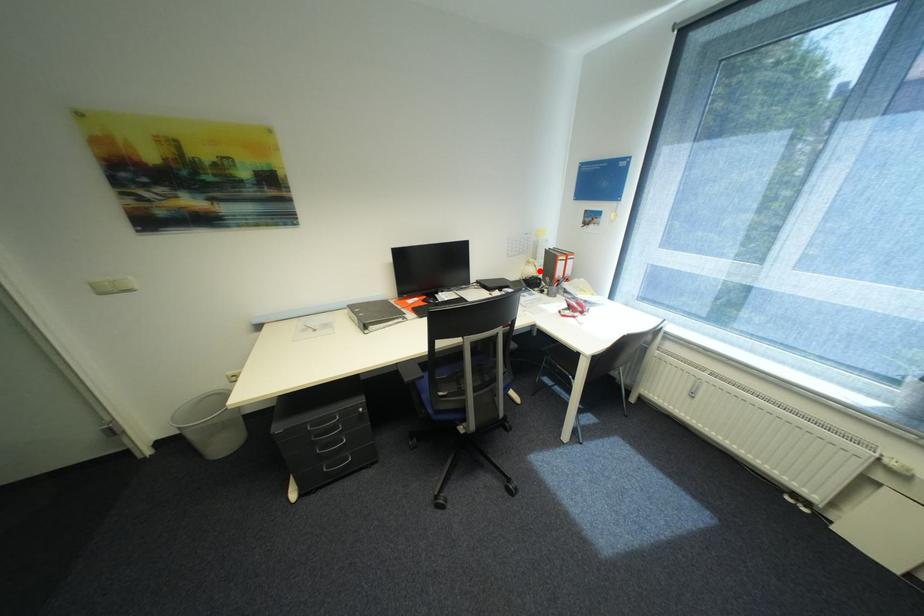
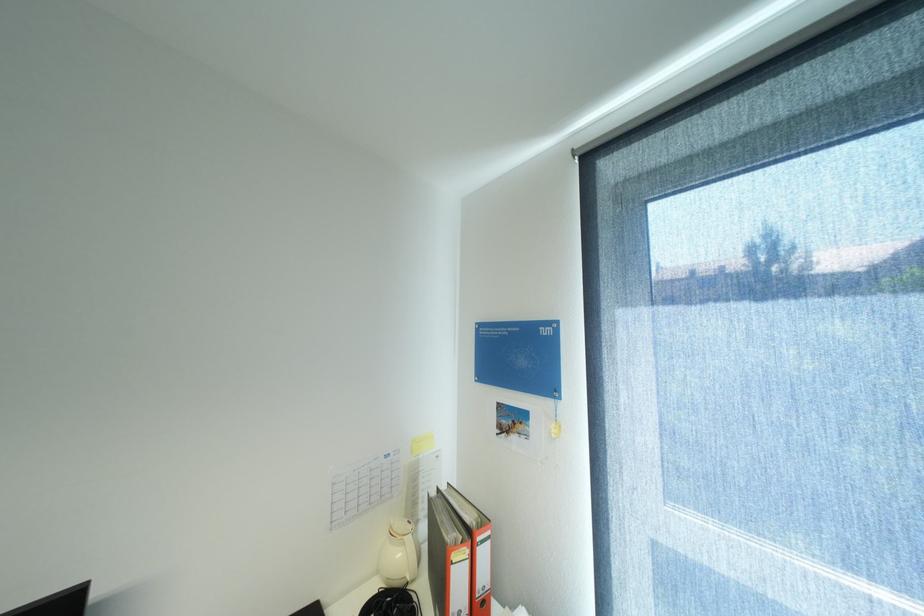
Question: I am providing you with two images of the same scene from different viewpoints. A red point is shown in image1. For the corresponding object point in image2, is it positioned nearer or farther from the camera?

Choices:
 (A) Nearer
 (B) Farther

Answer: (B)